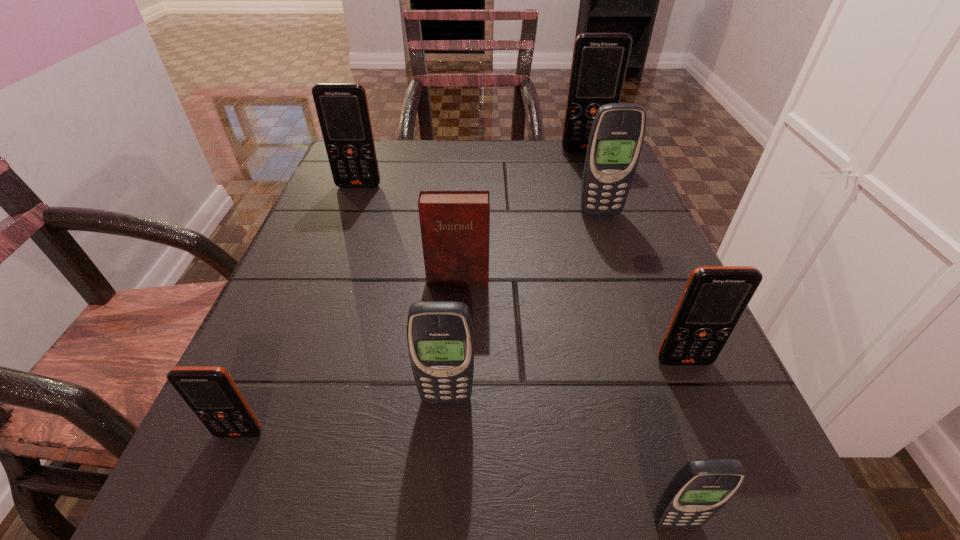
Find the location of a particular element. This screenshot has width=960, height=540. vacant space at the right edge of the desktop is located at coordinates (586, 273).

This screenshot has height=540, width=960. What are the coordinates of `vacant area at the near left corner` in the screenshot? It's located at (227, 471).

You are a GUI agent. You are given a task and a screenshot of the screen. Output one action in this format:
    pyautogui.click(x=<x>, y=<y>)
    Task: Click on the vacant space at the far right corner
    
    Given the screenshot: What is the action you would take?
    pyautogui.click(x=585, y=164)

The image size is (960, 540). I want to click on free space between the fourth farthest object and the fifth nearest cellular telephone, so click(x=529, y=246).

At what (x,y) coordinates should I click in order to perform the action: click on free spot between the nearest object and the second farthest orange cellular telephone. Please return your answer as a coordinate pair (x, y). Looking at the image, I should click on (517, 354).

Locate an element on the screen. vacant region between the biggest orange cellular telephone and the fifth farthest cellular telephone is located at coordinates (516, 274).

The image size is (960, 540). Find the location of `unoccupied area between the farthest gray cellular telephone and the nearest object`. unoccupied area between the farthest gray cellular telephone and the nearest object is located at coordinates coord(637,367).

This screenshot has height=540, width=960. In order to click on vacant area that lies between the second farthest cellular telephone and the reddish-brown diary in this screenshot , I will do `click(408, 232)`.

Locate an element on the screen. The image size is (960, 540). free spot between the sixth farthest cellular telephone and the seventh nearest object is located at coordinates (300, 309).

What are the coordinates of `free spot between the third nearest object and the sixth nearest object` in the screenshot? It's located at (523, 306).